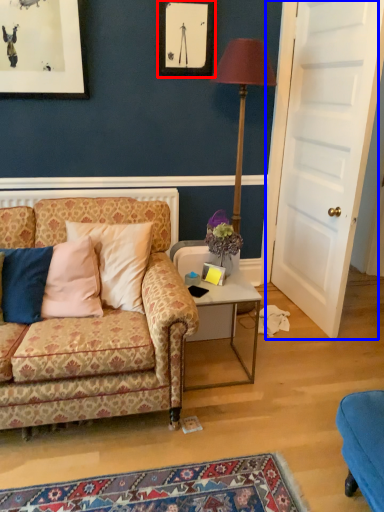
Question: Among these objects, which one is nearest to the camera, picture frame (highlighted by a red box) or door (highlighted by a blue box)?

Choices:
 (A) picture frame
 (B) door

Answer: (B)